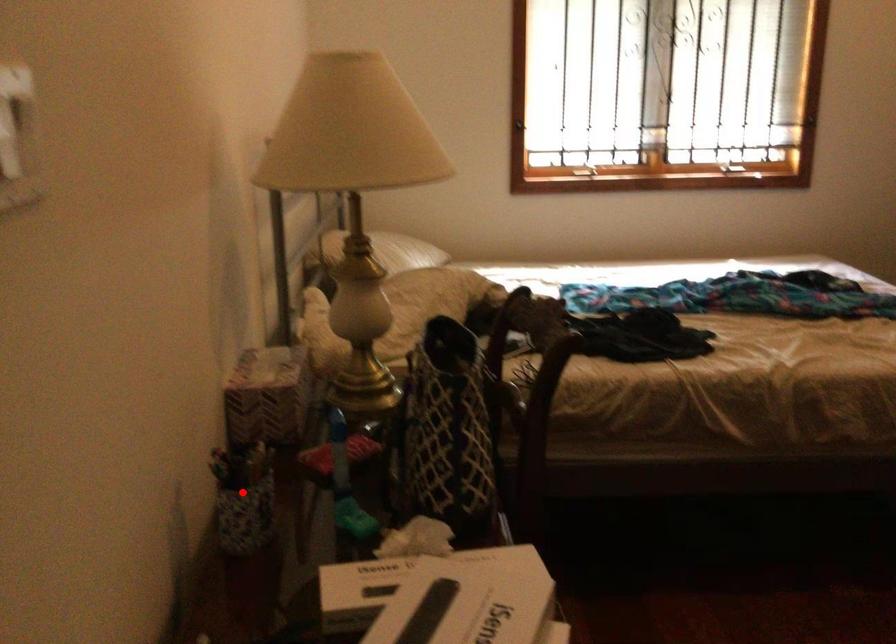
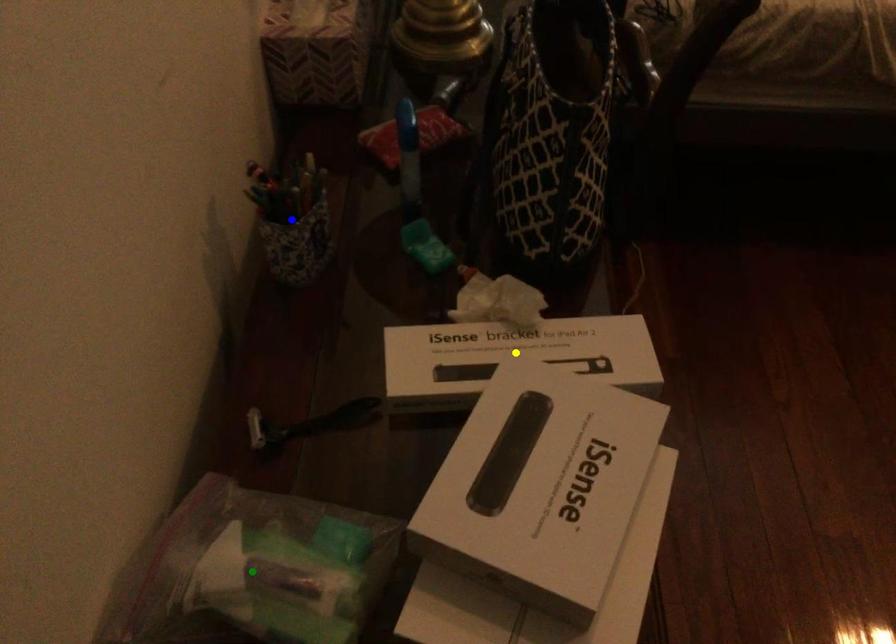
Question: I am providing you with two images of the same scene from different viewpoints. A red point is marked on the first image. You are given multiple points on the second image. Which mark in image 2 goes with the point in image 1?

Choices:
 (A) green point
 (B) blue point
 (C) yellow point

Answer: (B)